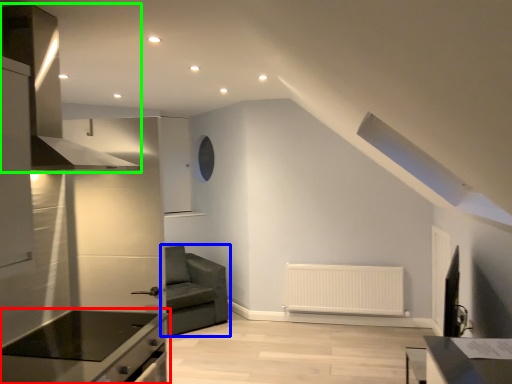
Question: Which is farther away from countertop (highlighted by a red box)? studio couch (highlighted by a blue box) or exhaust hood (highlighted by a green box)?

Choices:
 (A) studio couch
 (B) exhaust hood

Answer: (A)